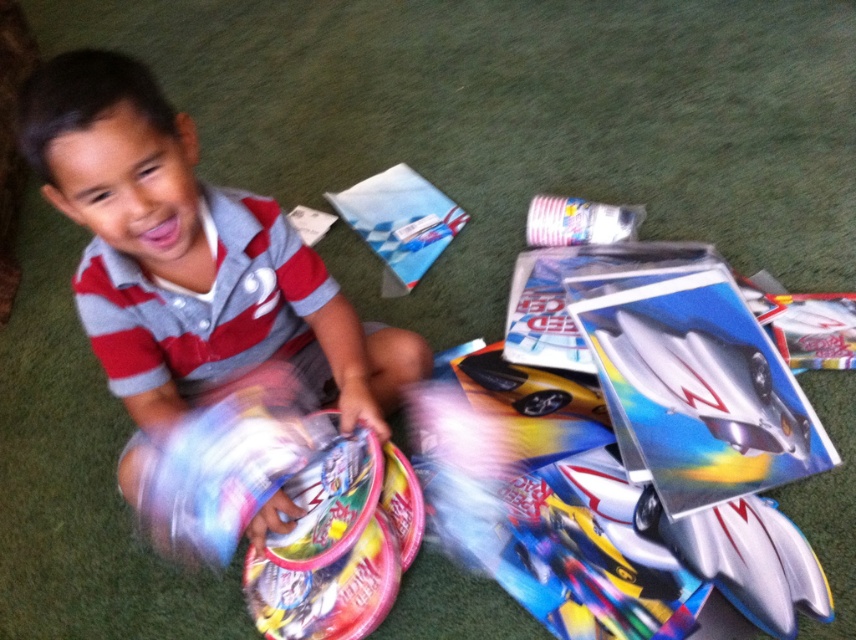
Question: In this image, where is metallic silver toy car at center located relative to glossy plastic toy at lower left?

Choices:
 (A) right
 (B) left

Answer: (A)

Question: Which point is farther to the camera?

Choices:
 (A) matte gray shirt at center
 (B) metallic silver toy car at center

Answer: (B)

Question: Which point is closer to the camera?

Choices:
 (A) metallic silver toy car at center
 (B) glossy plastic toy at lower left
 (C) matte gray shirt at center

Answer: (C)

Question: Is matte gray shirt at center bigger than glossy plastic toy at lower left?

Choices:
 (A) yes
 (B) no

Answer: (A)

Question: Can you confirm if metallic silver toy car at center is positioned to the right of glossy plastic toy at lower left?

Choices:
 (A) no
 (B) yes

Answer: (B)

Question: Which point is farther to the camera?

Choices:
 (A) (734, 394)
 (B) (349, 394)

Answer: (A)